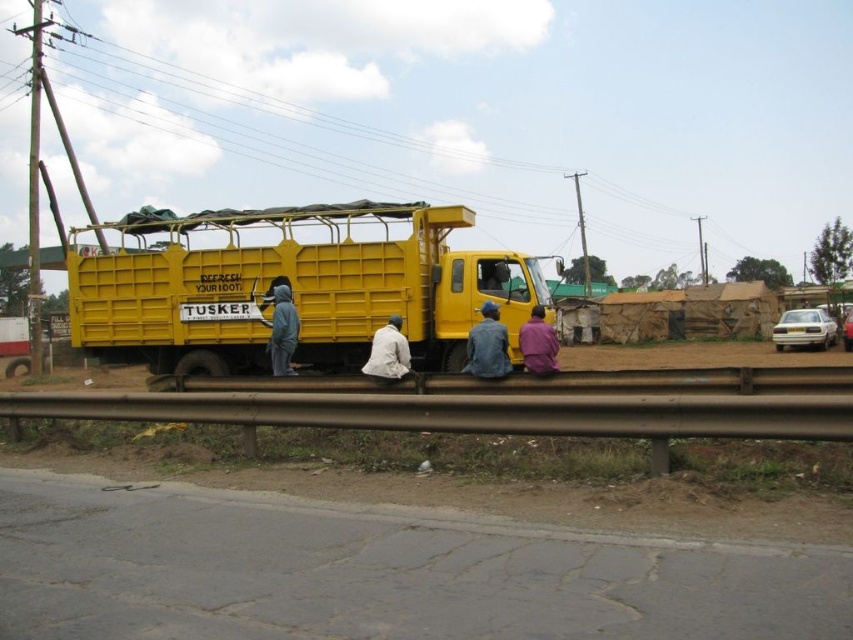
Based on the photo, between denim jacket at center and purple fabric shirt at lower center, which one is positioned higher?

denim jacket at center is above.

Does denim jacket at center have a lesser width compared to purple fabric shirt at lower center?

No.

I want to click on denim jacket at center, so click(486, 346).

Where is `denim jacket at center`? This screenshot has width=853, height=640. denim jacket at center is located at coordinates click(x=486, y=346).

Does point (367, 371) lie in front of point (277, 333)?

Yes, point (367, 371) is closer to viewer.

Find the location of `white matte jacket at center`. white matte jacket at center is located at coordinates (387, 353).

Measure the distance from gray hoodie at left to purple fabric shirt at lower center.

A distance of 13.23 feet exists between gray hoodie at left and purple fabric shirt at lower center.

Is point (273, 333) farther from camera compared to point (521, 326)?

That is True.

Is point (271, 296) closer to viewer compared to point (537, 362)?

No, it is behind (537, 362).

This screenshot has width=853, height=640. In order to click on gray hoodie at left in this screenshot , I will do `click(282, 330)`.